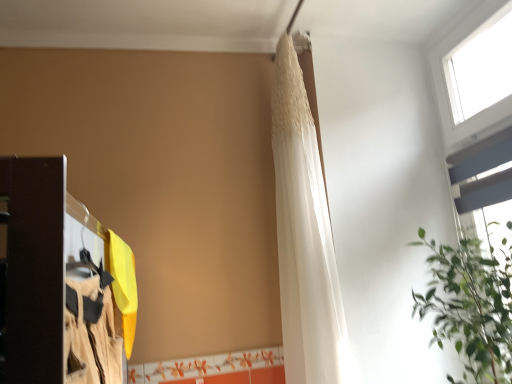
Question: From the image's perspective, relative to green leafy plant at upper right, is white sheer fabric at upper center above or below?

Choices:
 (A) below
 (B) above

Answer: (B)

Question: From a real-world perspective, relative to green leafy plant at upper right, is white sheer fabric at upper center vertically above or below?

Choices:
 (A) below
 (B) above

Answer: (B)

Question: Estimate the real-world distances between objects in this image. Which object is closer to the white plastic window at upper right?

Choices:
 (A) green leafy plant at upper right
 (B) white sheer fabric at upper center

Answer: (A)

Question: Considering the real-world distances, which object is closest to the green leafy plant at upper right?

Choices:
 (A) white plastic window at upper right
 (B) white sheer fabric at upper center

Answer: (B)